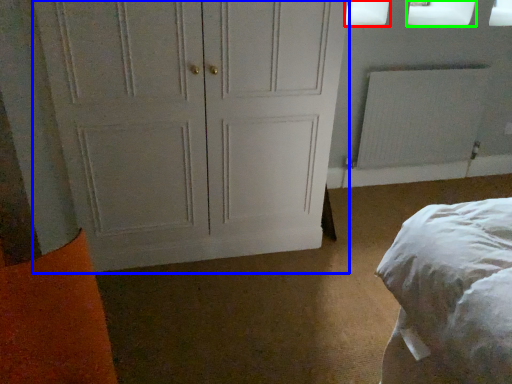
Question: Which is nearer to the window screen (highlighted by a red box)? door (highlighted by a blue box) or window screen (highlighted by a green box).

Choices:
 (A) door
 (B) window screen

Answer: (B)